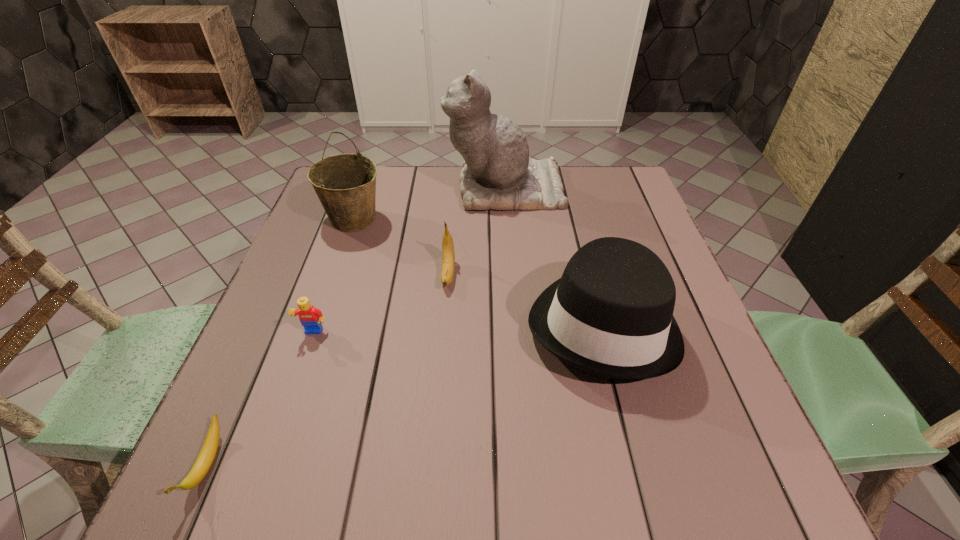
Locate an element on the screen. The width and height of the screenshot is (960, 540). vacant space in between the fifth tallest object and the third tallest object is located at coordinates click(458, 328).

Find the location of `blank region between the right banana and the fifth shortest object`. blank region between the right banana and the fifth shortest object is located at coordinates (400, 247).

This screenshot has width=960, height=540. Find the location of `empty space between the wine bucket and the second shortest object`. empty space between the wine bucket and the second shortest object is located at coordinates (333, 276).

Where is `vacant point located between the tallest object and the second tallest object`? vacant point located between the tallest object and the second tallest object is located at coordinates (429, 204).

You are a GUI agent. You are given a task and a screenshot of the screen. Output one action in this format:
    pyautogui.click(x=<x>, y=<y>)
    Task: Click on the free space that is in between the Lego and the fourth tallest object
    The width and height of the screenshot is (960, 540).
    Given the screenshot: What is the action you would take?
    pyautogui.click(x=381, y=304)

Find the location of `free space between the nearest object and the fourth tallest object`. free space between the nearest object and the fourth tallest object is located at coordinates (327, 369).

Locate an element on the screen. The image size is (960, 540). free space between the tallest object and the wine bucket is located at coordinates (429, 204).

Image resolution: width=960 pixels, height=540 pixels. In order to click on vacant point located between the fedora and the fifth tallest object in this screenshot , I will do `click(458, 328)`.

The image size is (960, 540). I want to click on object identified as the fifth closest to the tallest object, so click(207, 454).

At what (x,y) coordinates should I click in order to perform the action: click on object that is the closest to the cat. Please return your answer as a coordinate pair (x, y). Looking at the image, I should click on (345, 184).